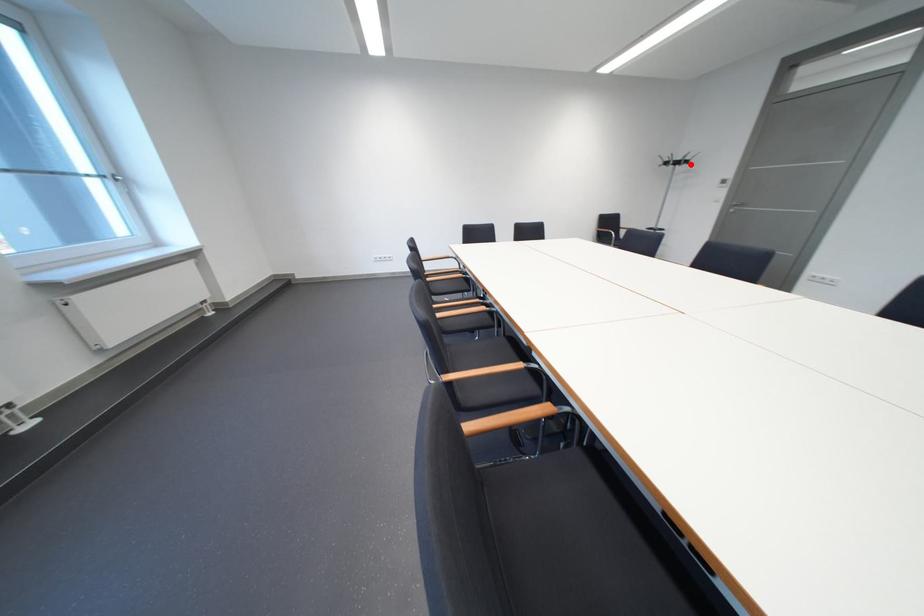
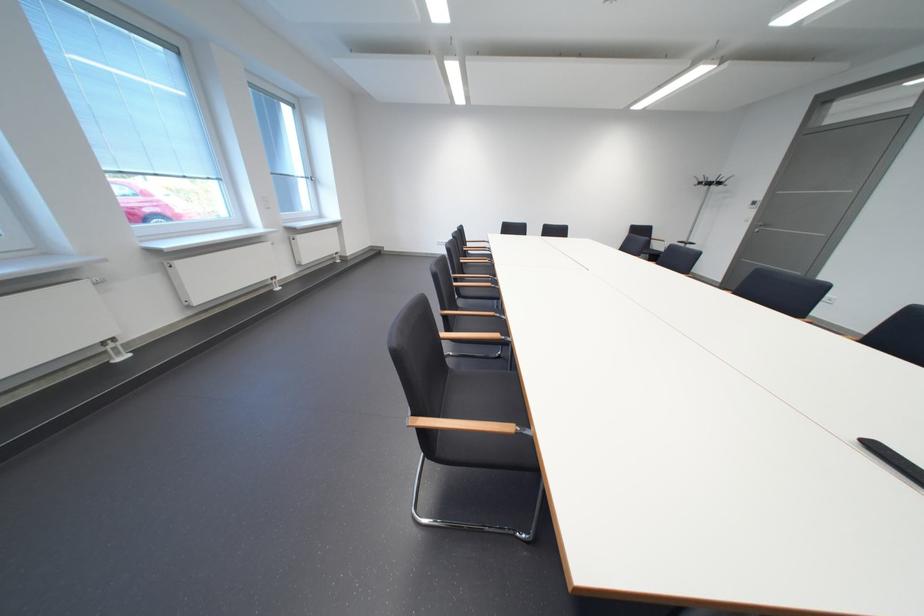
Find the pixel in the second image that matches the highlighted location in the first image.

(723, 185)